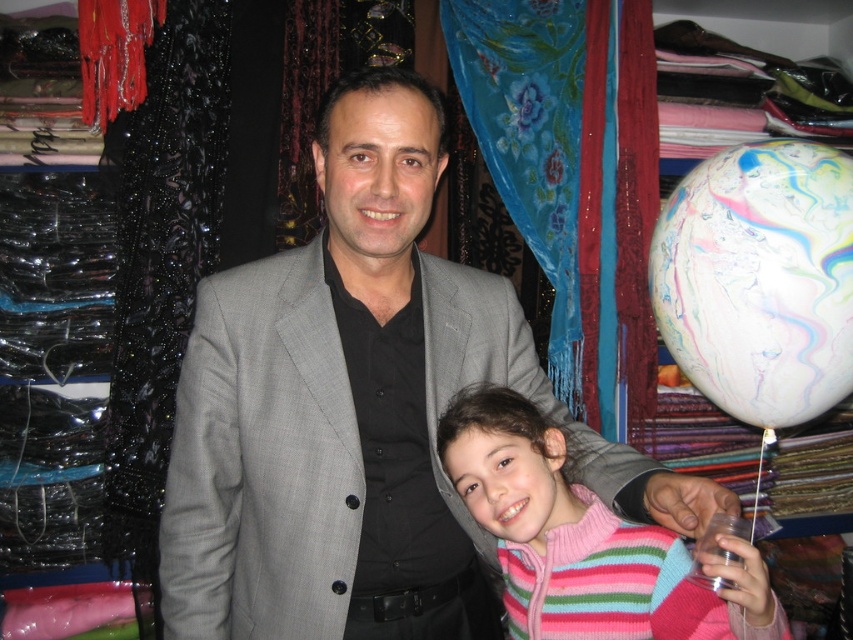
Question: Estimate the real-world distances between objects in this image. Which object is farther from the pink striped sweater at center?

Choices:
 (A) transparent plastic cup at lower right
 (B) gray woolen suit at center

Answer: (A)

Question: Does pink striped sweater at center appear under transparent plastic cup at lower right?

Choices:
 (A) yes
 (B) no

Answer: (A)

Question: Which of these objects is positioned closest to the pink striped sweater at center?

Choices:
 (A) gray woolen suit at center
 (B) transparent plastic cup at lower right

Answer: (A)

Question: Is gray woolen suit at center positioned at the back of transparent plastic cup at lower right?

Choices:
 (A) yes
 (B) no

Answer: (A)

Question: Which object is farther from the camera taking this photo?

Choices:
 (A) transparent plastic cup at lower right
 (B) pink striped sweater at center
 (C) gray woolen suit at center

Answer: (C)

Question: Can you confirm if gray woolen suit at center is smaller than pink striped sweater at center?

Choices:
 (A) yes
 (B) no

Answer: (B)